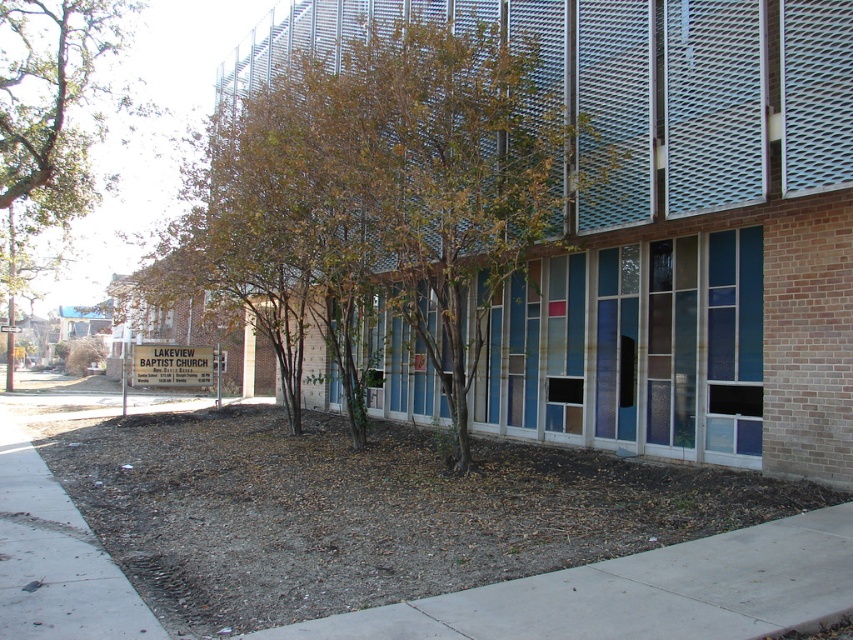
You are a gardener planning to plant a new tree in the area. Given the presence of the green leafy tree at center and the gray concrete sidewalk at lower center, which object would you consider in terms of space requirements for the new tree?

The green leafy tree at center has a larger size compared to the gray concrete sidewalk at lower center, so you should consider the space occupied by the green leafy tree at center when planning the new tree planting to ensure adequate room for growth.

Looking at this image, you are standing on the gray concrete sidewalk at lower center and want to walk to the entrance of the modern building. Which direction should you go relative to the concrete sidewalk at center?

You should walk to the right relative to the concrete sidewalk at center because the gray concrete sidewalk at lower center is to the right of it.

You are standing at the point marked as point (x=77, y=586) and want to walk to the entrance of the modern building. The path is 16.98 feet long. If your average walking speed is 3 feet per second, how many seconds will it take you to reach the entrance?

The path between point (x=77, y=586) and the entrance of the modern building is 16.98 feet long. At a walking speed of 3 feet per second, it will take approximately 5.66 seconds to reach the entrance.